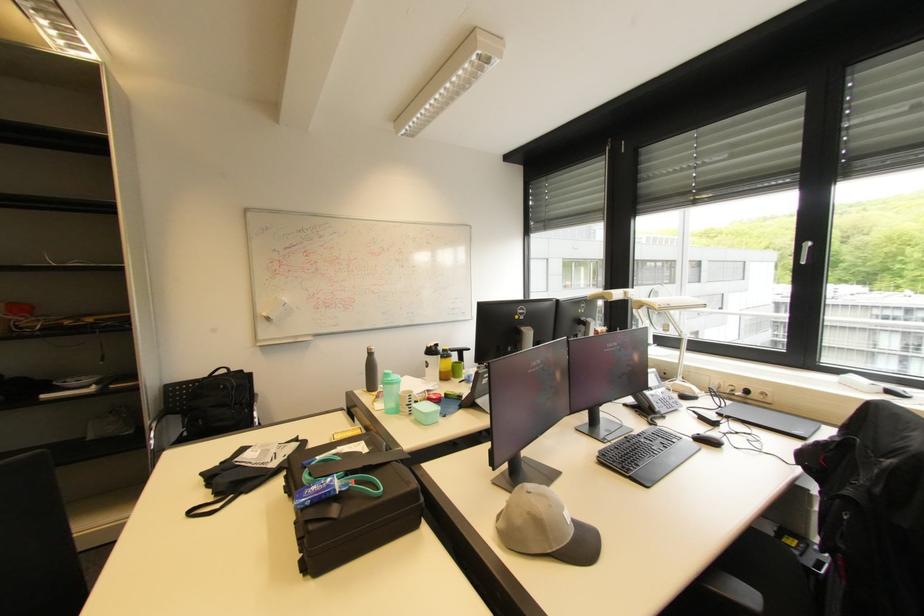
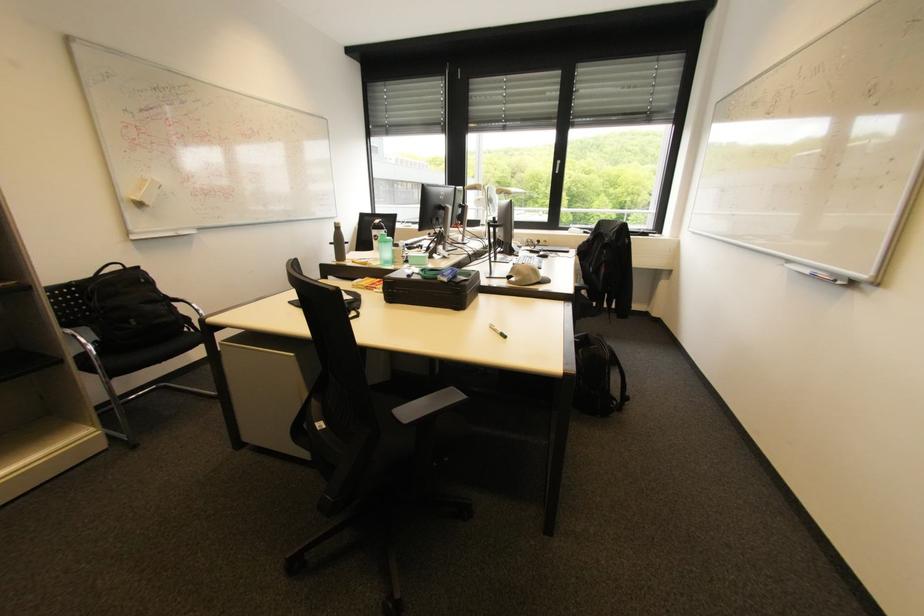
In the second image, find the point that corresponds to point 756,398 in the first image.

(544, 245)